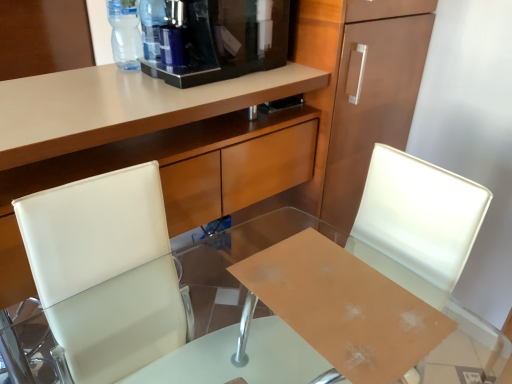
This screenshot has height=384, width=512. I want to click on free space in front of transparent plastic bottle at upper center, marked as the second bottle in a right-to-left arrangement, so click(131, 79).